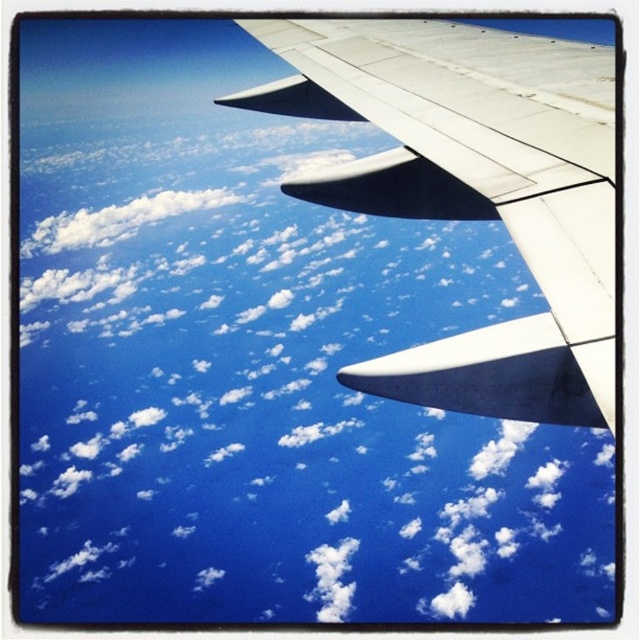
You are a passenger sitting by the window and want to take a photo of the white fluffy cloud at upper center and the white matte wing at upper right. Which object should you point your camera towards first if you want to capture both in one shot?

The white fluffy cloud at upper center is located above the white matte wing at upper right, so you should point your camera upwards first to include both in the frame.

You are a pilot checking the distance between the white fluffy cloud at upper center and the white matte wing at upper right. According to the aircraft instruments, what is the minimum safe distance required for flying near clouds? Is the current distance sufficient?

The minimum safe distance required for flying near clouds is typically 1,600 feet vertically or 2,000 feet horizontally. Since the distance between the white fluffy cloud at upper center and the white matte wing at upper right is 480.60 meters, which is approximately 1,577 feet, it is slightly below the vertical safety threshold. Therefore, the current distance is not sufficient for safe flying conditions.

You are a flight attendant observing the view from the airplane window. You notice the white fluffy cloud at upper center and the white matte wing at upper right. Which object is positioned closer to the left side of the window?

The white fluffy cloud at upper center is positioned to the left of the white matte wing at upper right, so it is closer to the left side of the window.